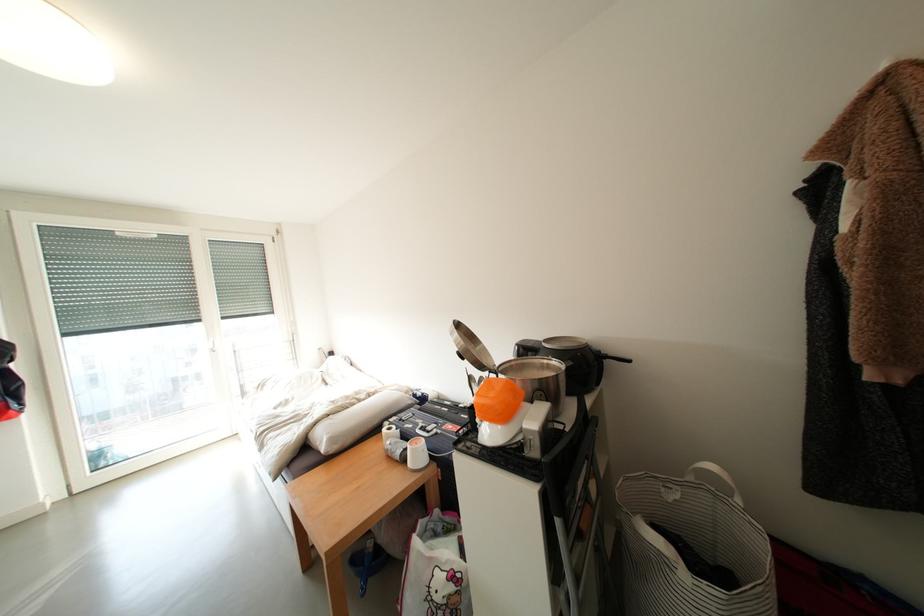
Find where to lift the black appliance handle. Please return your answer as a coordinate pair (x, y).

(619, 358)